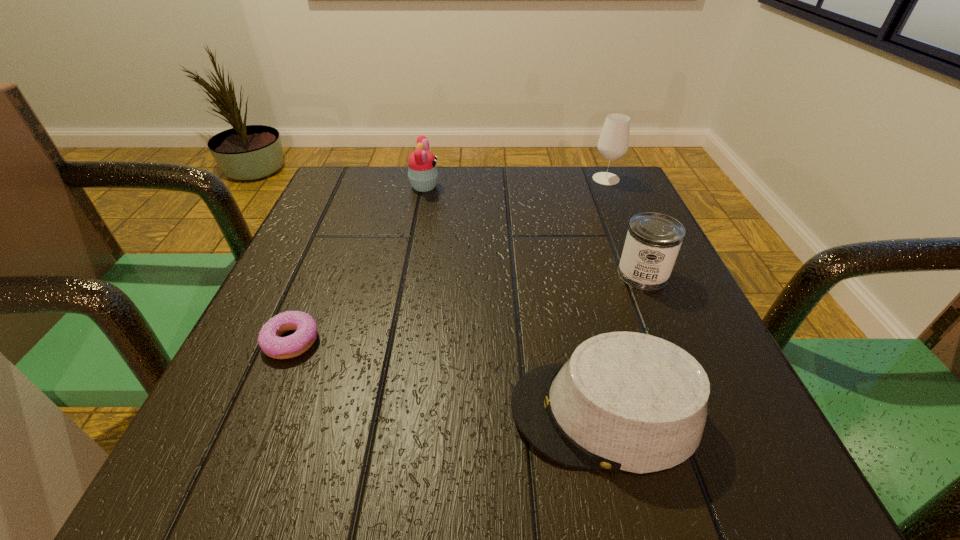
Identify the location of free space between the doughnut and the hat. (448, 377).

The image size is (960, 540). Identify the location of blank region between the second shortest object and the glass. (606, 295).

The width and height of the screenshot is (960, 540). In order to click on free space between the glass and the doughnut in this screenshot , I will do `click(448, 260)`.

Where is `unoccupied area between the second object from left to right and the second shortest object`? unoccupied area between the second object from left to right and the second shortest object is located at coordinates (515, 300).

Identify the location of vacant area that lies between the third nearest object and the tallest object. (624, 226).

Identify the location of unoccupied position between the leftmost object and the hat. (448, 377).

Find the location of a particular element. vacant area that lies between the third farthest object and the shortest object is located at coordinates (467, 308).

I want to click on the second closest object relative to the fourth object from right to left, so click(x=270, y=341).

Where is `object that is the third closest to the can`? The height and width of the screenshot is (540, 960). object that is the third closest to the can is located at coordinates (422, 169).

Identify the location of free space that satisfies the following two spatial constraints: 1. on the face of the cupcake; 2. on the front side of the leftmost object. (395, 341).